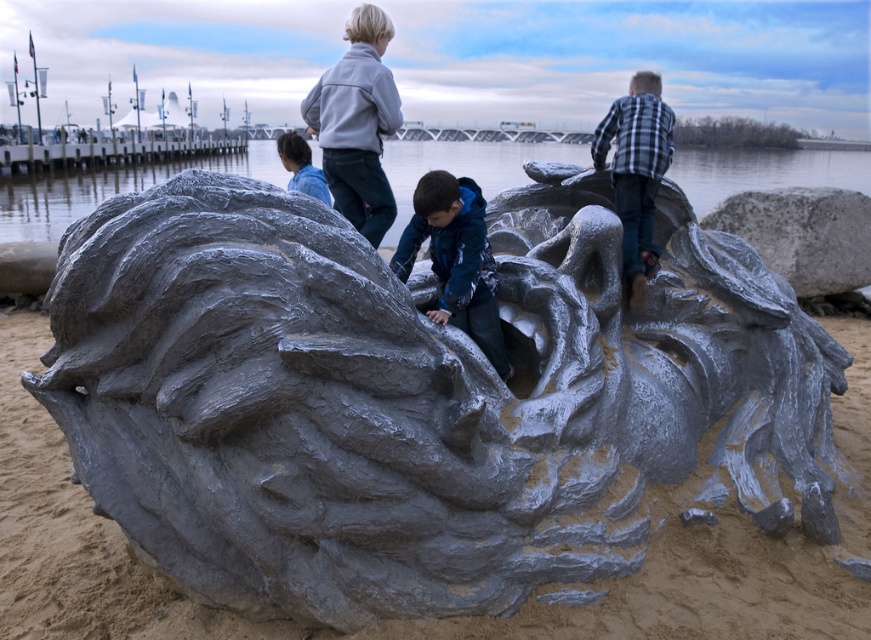
You are standing at the origin point of the image coordinate system. Where is the matte gray sculpture at center located in terms of coordinates?

The matte gray sculpture at center is located at coordinates point (456,259).

You are a tourist standing at the waterfront and want to take a photo of the clear water at center and the gray matte rock at upper right in the same frame. How far apart are these two objects from each other?

The clear water at center is 7.27 meters away from the gray matte rock at upper right.

You are standing in front of the dragon sculpture and want to place a small flag at point (51, 179) and point (845, 248). Which point is closer to you?

Point (51, 179) is closer to you because it is further to the viewer than point (845, 248).